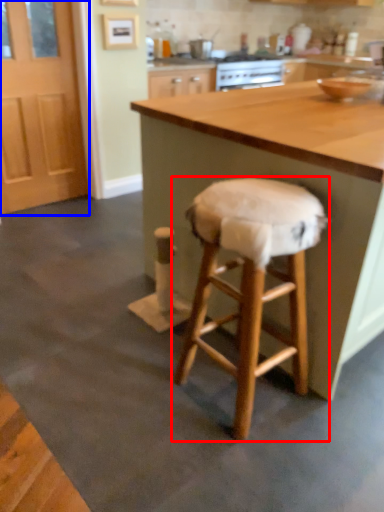
Question: Among these objects, which one is farthest to the camera, stool (highlighted by a red box) or screen door (highlighted by a blue box)?

Choices:
 (A) stool
 (B) screen door

Answer: (B)